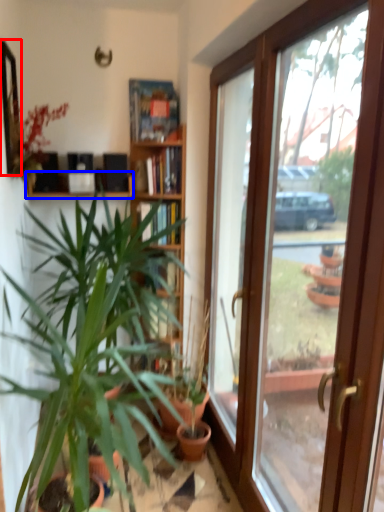
Question: Which object appears closest to the camera in this image, mirror (highlighted by a red box) or shelf (highlighted by a blue box)?

Choices:
 (A) mirror
 (B) shelf

Answer: (A)